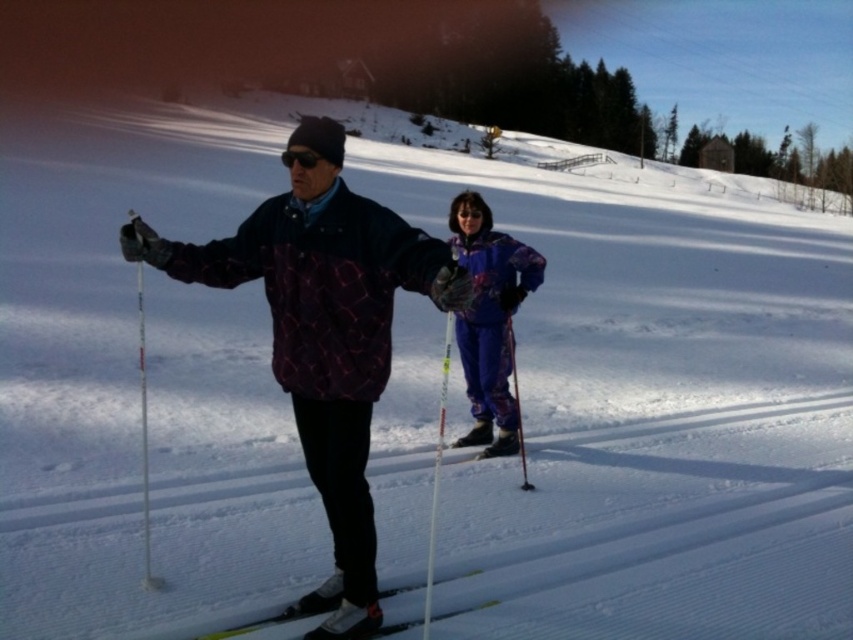
Question: Is white plastic ski pole at left thinner than yellow matte ski at lower center?

Choices:
 (A) no
 (B) yes

Answer: (A)

Question: Which point is farther to the camera?

Choices:
 (A) white plastic ski pole at left
 (B) matte black ski pole at center

Answer: (B)

Question: Is matte purple jacket at center smaller than matte purple ski suit at center?

Choices:
 (A) no
 (B) yes

Answer: (B)

Question: Among these points, which one is farthest from the camera?

Choices:
 (A) (476, 323)
 (B) (520, 419)

Answer: (B)

Question: Which point is closer to the camera?

Choices:
 (A) (141, 406)
 (B) (514, 390)

Answer: (A)

Question: Is matte purple ski suit at center thinner than white plastic ski pole at center?

Choices:
 (A) yes
 (B) no

Answer: (B)